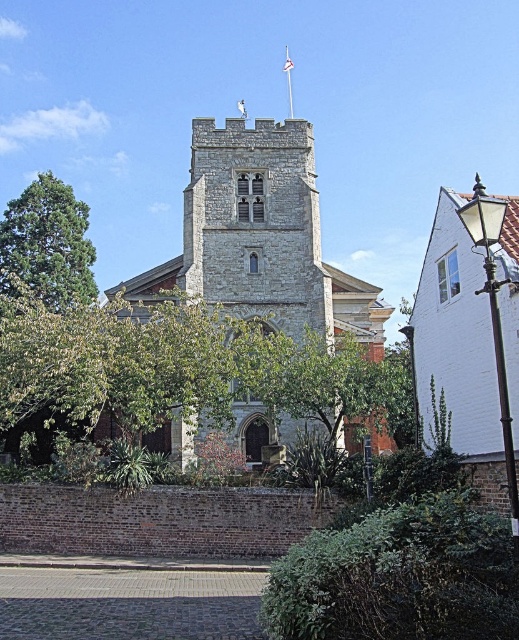
How far apart are stone church at center and green leafy tree at left?

A distance of 52.51 feet exists between stone church at center and green leafy tree at left.

Between point (230, 269) and point (64, 218), which one is positioned in front?

Point (230, 269) is in front.

Where is `stone church at center`? stone church at center is located at coordinates (260, 237).

Is stone church at center positioned before green leafy tree at center?

No, it is not.

Between point (378, 330) and point (306, 385), which one is positioned in front?

Point (306, 385)

The image size is (519, 640). What are the coordinates of `stone church at center` in the screenshot? It's located at (260, 237).

Looking at this image, which is more to the right, green leafy tree at center or green leafy tree at left?

From the viewer's perspective, green leafy tree at center appears more on the right side.

Between green leafy tree at center and green leafy tree at left, which one appears on the left side from the viewer's perspective?

green leafy tree at left

This screenshot has width=519, height=640. I want to click on green leafy tree at center, so click(x=320, y=381).

Locate an element on the screen. green leafy tree at center is located at coordinates (320, 381).